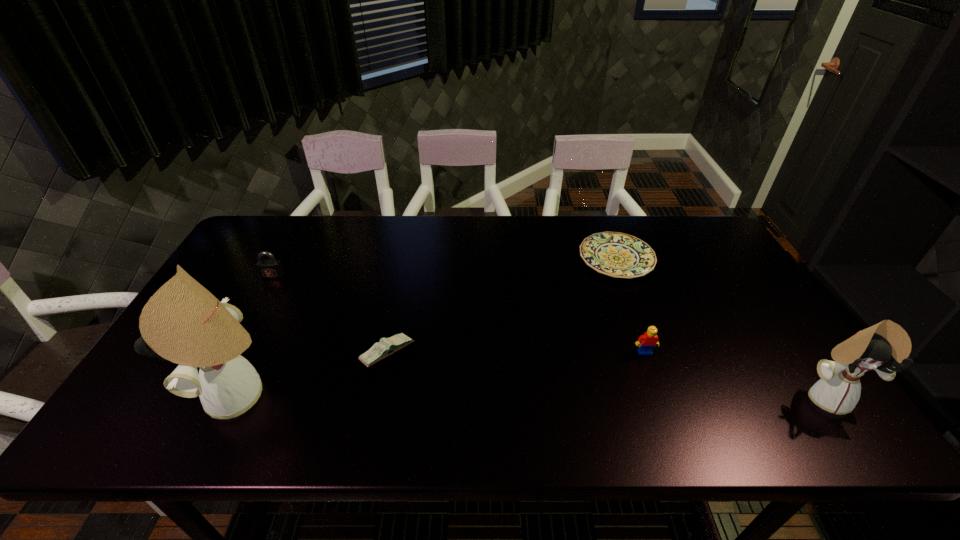
You are a GUI agent. You are given a task and a screenshot of the screen. Output one action in this format:
    pyautogui.click(x=<x>, y=<y>)
    Task: Click on the free space between the rightmost object and the taller doll
    Image resolution: width=960 pixels, height=540 pixels.
    Given the screenshot: What is the action you would take?
    pyautogui.click(x=534, y=396)

Identify the location of free space between the padlock and the fifth tallest object. (330, 314).

The height and width of the screenshot is (540, 960). In order to click on vacant space that's between the third object from left to right and the plate in this screenshot , I will do `click(502, 306)`.

What are the coordinates of `free space between the shortest object and the tallest object` in the screenshot? It's located at (429, 327).

Image resolution: width=960 pixels, height=540 pixels. In order to click on vacant point located between the plate and the Lego in this screenshot , I will do `click(631, 306)`.

At what (x,y) coordinates should I click in order to perform the action: click on free area in between the right doll and the diary. Please return your answer as a coordinate pair (x, y). The height and width of the screenshot is (540, 960). Looking at the image, I should click on (607, 375).

Locate an element on the screen. object that can be found as the third closest to the shorter doll is located at coordinates (387, 346).

Identify the location of object that is the closest one to the plate. Image resolution: width=960 pixels, height=540 pixels. (647, 342).

In order to click on vacant position in the image that satisfies the following two spatial constraints: 1. on the face of the Lego; 2. at the front face of the taller doll in this screenshot , I will do `click(660, 395)`.